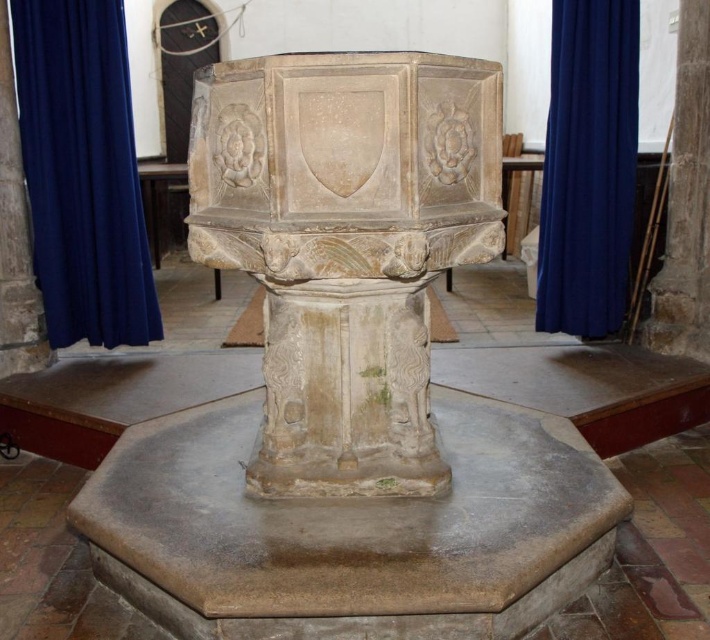
You are a visitor standing in the church and want to see the stone carved baptismal font at center. Which direction should you look to ensure the blue fabric curtain at right does not block your view?

The stone carved baptismal font at center is below the blue fabric curtain at right. To avoid the curtain blocking your view, look downward toward the font located beneath the curtain.